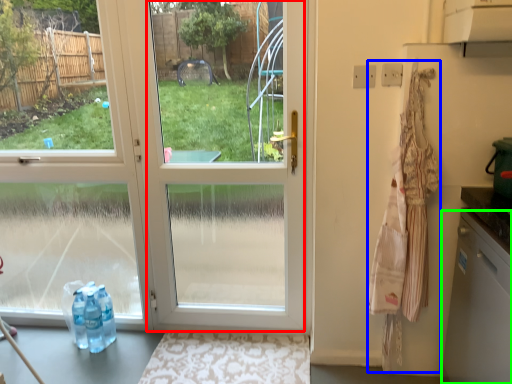
Question: Which object is the farthest from glass door (highlighted by a red box)? Choose among these: laundry (highlighted by a blue box) or dish washer (highlighted by a green box).

Choices:
 (A) laundry
 (B) dish washer

Answer: (A)